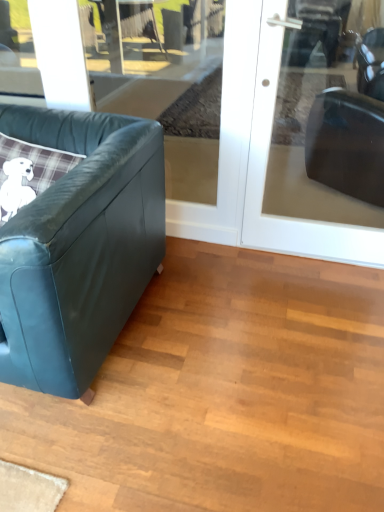
Question: Should I look upward or downward to see leather couch at left?

Choices:
 (A) up
 (B) down

Answer: (A)

Question: Is transparent glass door at upper right wider than leather couch at left?

Choices:
 (A) no
 (B) yes

Answer: (A)

Question: Is leather couch at left completely or partially inside transparent glass door at upper right?

Choices:
 (A) yes
 (B) no

Answer: (B)

Question: From a real-world perspective, is transparent glass door at upper right physically below leather couch at left?

Choices:
 (A) no
 (B) yes

Answer: (A)

Question: Can you confirm if transparent glass door at upper right is taller than leather couch at left?

Choices:
 (A) no
 (B) yes

Answer: (B)

Question: Can you confirm if transparent glass door at upper right is positioned to the left of leather couch at left?

Choices:
 (A) no
 (B) yes

Answer: (A)

Question: Is transparent glass door at upper right turned away from leather couch at left?

Choices:
 (A) no
 (B) yes

Answer: (A)

Question: Is transparent glass door at upper right taller than transparent glass door at upper left?

Choices:
 (A) yes
 (B) no

Answer: (A)

Question: From the image's perspective, is transparent glass door at upper right over transparent glass door at upper left?

Choices:
 (A) no
 (B) yes

Answer: (A)

Question: Is transparent glass door at upper right positioned before transparent glass door at upper left?

Choices:
 (A) yes
 (B) no

Answer: (A)

Question: Is transparent glass door at upper right not near transparent glass door at upper left?

Choices:
 (A) no
 (B) yes

Answer: (B)

Question: Is transparent glass door at upper right completely or partially outside of transparent glass door at upper left?

Choices:
 (A) yes
 (B) no

Answer: (A)

Question: Is transparent glass door at upper left surrounded by transparent glass door at upper right?

Choices:
 (A) no
 (B) yes

Answer: (A)

Question: Considering the relative sizes of leather couch at left and transparent glass door at upper left in the image provided, is leather couch at left bigger than transparent glass door at upper left?

Choices:
 (A) yes
 (B) no

Answer: (A)